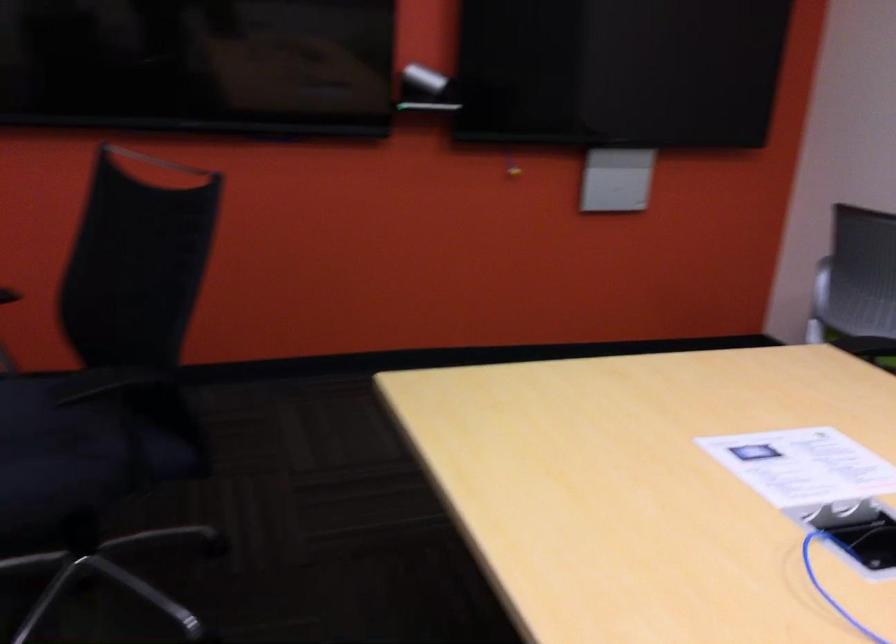
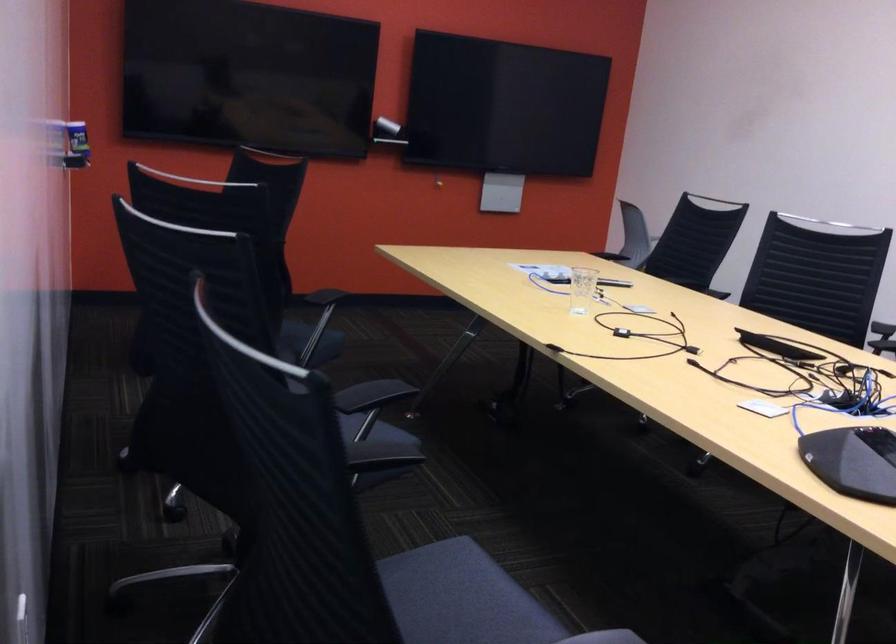
Question: I am providing you with two images of the same scene from different viewpoints. After the viewpoint changes to image2, which objects are now occluded?

Choices:
 (A) black remote control
 (B) black conference phone
 (C) black chair sitting surface
 (D) stack of red books

Answer: (C)